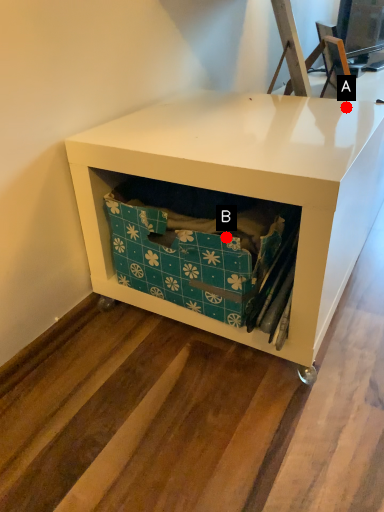
Question: Two points are circled on the image, labeled by A and B beside each circle. Among these points, which one is farthest from the camera?

Choices:
 (A) A is further
 (B) B is further

Answer: (A)